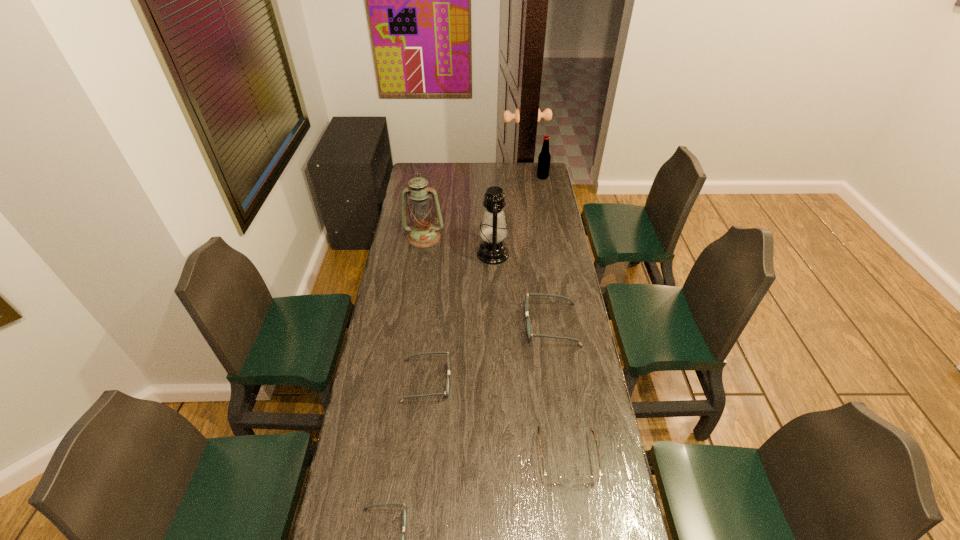
You are a GUI agent. You are given a task and a screenshot of the screen. Output one action in this format:
    pyautogui.click(x=<x>, y=<y>)
    Task: Click on the oil lamp that is at the left edge
    This screenshot has height=540, width=960.
    Given the screenshot: What is the action you would take?
    pyautogui.click(x=423, y=234)

Locate an element on the screen. The width and height of the screenshot is (960, 540). spectacles positioned at the left edge is located at coordinates (446, 392).

What are the coordinates of `beer bottle located at the right edge` in the screenshot? It's located at (544, 158).

Image resolution: width=960 pixels, height=540 pixels. In order to click on object that is at the far right corner in this screenshot , I will do `click(544, 158)`.

This screenshot has height=540, width=960. I want to click on vacant area at the far edge, so click(489, 178).

Where is `free space at the left edge`? Image resolution: width=960 pixels, height=540 pixels. free space at the left edge is located at coordinates (389, 496).

In the image, there is a desktop. Where is `free space at the right edge`? The image size is (960, 540). free space at the right edge is located at coordinates (532, 198).

The width and height of the screenshot is (960, 540). I want to click on free point between the second nearest object and the left oil lamp, so click(495, 347).

This screenshot has height=540, width=960. In order to click on vacant space in between the second nearest gray spectacles and the second nearest object in this screenshot , I will do `click(497, 419)`.

Find the location of a particular element. The image size is (960, 540). empty space between the brown spectacles and the second farthest gray spectacles is located at coordinates (497, 419).